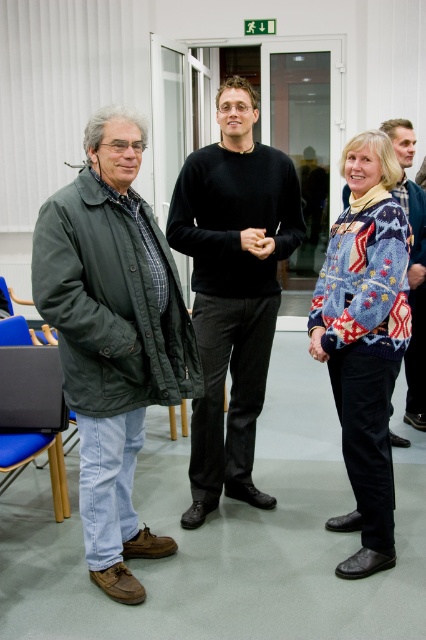
You are a photographer who needs to take a photo of the black smooth sweater at center. You have a camera that has a minimum focusing distance of 5 feet. Can you take the photo without moving closer than 5 feet?

The black smooth sweater at center and camera are 7.58 feet apart from each other. Since the minimum focusing distance is 5 feet, you can take the photo without moving closer because the distance is sufficient.